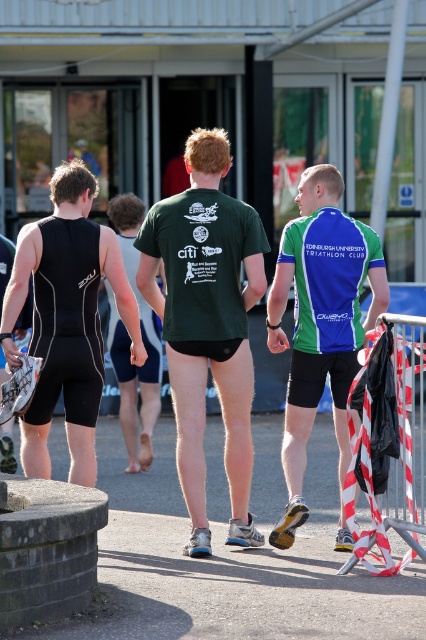
Question: Where is matte black triathlon suit at left located in relation to red and white striped tape at right in the image?

Choices:
 (A) above
 (B) below

Answer: (A)

Question: Which object is closer to the camera taking this photo?

Choices:
 (A) green matte shorts at center
 (B) red and white striped tape at right

Answer: (B)

Question: Considering the real-world distances, which object is farthest from the matte black triathlon suit at left?

Choices:
 (A) red and white striped tape at right
 (B) green/blue jersey at center
 (C) green matte t-shirt at center
 (D) green matte shorts at center

Answer: (D)

Question: Is red and white striped tape at right thinner than black matte wetsuit at left?

Choices:
 (A) yes
 (B) no

Answer: (B)

Question: Estimate the real-world distances between objects in this image. Which object is farther from the black matte wetsuit at left?

Choices:
 (A) red and white striped tape at right
 (B) green matte t-shirt at center
 (C) matte black triathlon suit at left
 (D) green matte shorts at center

Answer: (D)

Question: Can you confirm if green matte t-shirt at center is smaller than green matte shorts at center?

Choices:
 (A) no
 (B) yes

Answer: (B)